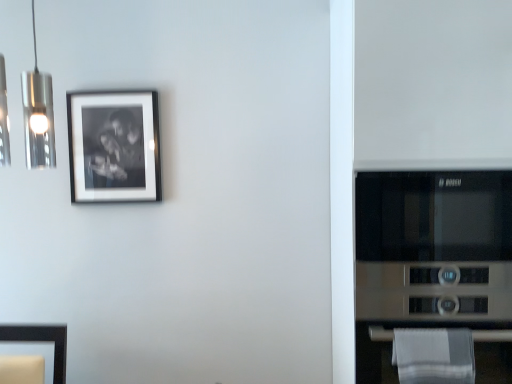
Question: Is white cotton towel at lower right smaller than stainless steel microwave at right?

Choices:
 (A) no
 (B) yes

Answer: (B)

Question: From the image's perspective, is white cotton towel at lower right located above stainless steel microwave at right?

Choices:
 (A) no
 (B) yes

Answer: (A)

Question: Is white cotton towel at lower right at the right side of stainless steel microwave at right?

Choices:
 (A) no
 (B) yes

Answer: (A)

Question: Considering the relative sizes of white cotton towel at lower right and stainless steel microwave at right in the image provided, is white cotton towel at lower right shorter than stainless steel microwave at right?

Choices:
 (A) no
 (B) yes

Answer: (B)

Question: Is stainless steel microwave at right located within white cotton towel at lower right?

Choices:
 (A) no
 (B) yes

Answer: (A)

Question: Is white cotton towel at lower right aimed at stainless steel microwave at right?

Choices:
 (A) no
 (B) yes

Answer: (B)

Question: From a real-world perspective, is matte black frame at upper left located beneath white cotton towel at lower right?

Choices:
 (A) yes
 (B) no

Answer: (B)

Question: Considering the relative positions of matte black frame at upper left and white cotton towel at lower right in the image provided, is matte black frame at upper left in front of white cotton towel at lower right?

Choices:
 (A) no
 (B) yes

Answer: (A)

Question: Is matte black frame at upper left at the right side of white cotton towel at lower right?

Choices:
 (A) yes
 (B) no

Answer: (B)

Question: From the image's perspective, is matte black frame at upper left on white cotton towel at lower right?

Choices:
 (A) yes
 (B) no

Answer: (A)

Question: Can white cotton towel at lower right be found inside matte black frame at upper left?

Choices:
 (A) yes
 (B) no

Answer: (B)

Question: Can you confirm if matte black frame at upper left is thinner than white cotton towel at lower right?

Choices:
 (A) no
 (B) yes

Answer: (B)

Question: From the image's perspective, is stainless steel microwave at right over matte black frame at upper left?

Choices:
 (A) no
 (B) yes

Answer: (A)